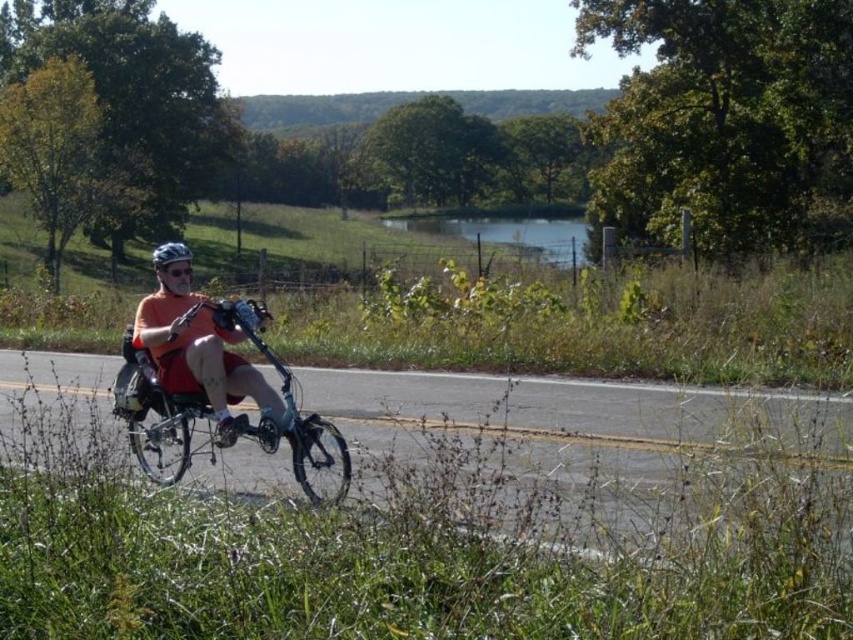
You are a photographer trying to capture the rider in the scene. Given that the orange matte shirt at center and the matte black helmet at center are both in focus, which object would appear smaller in your photo?

The orange matte shirt at center occupies less space than the matte black helmet at center, so it would appear smaller in the photo.

You are a photographer standing at the side of the road. You want to take a photo of the silver metallic bicycle at center and the orange matte shirt at center. Based on their positions, which object should you focus on first if you want both to be in sharp focus?

The silver metallic bicycle at center is located below the orange matte shirt at center. Since the shirt is higher in the frame, focusing on the shirt first would ensure both are in focus as the bicycle is below it.

You are a delivery person who needs to secure a package on the silver metallic bicycle at center. You have a strap that can only reach 6 feet. Can you tie the package using the strap from the matte black helmet at center to the back of the bicycle?

The silver metallic bicycle at center and matte black helmet at center are 6.49 feet apart. Since the strap can only reach 6 feet, it is not long enough to secure the package from the matte black helmet at center to the back of the silver metallic bicycle at center.